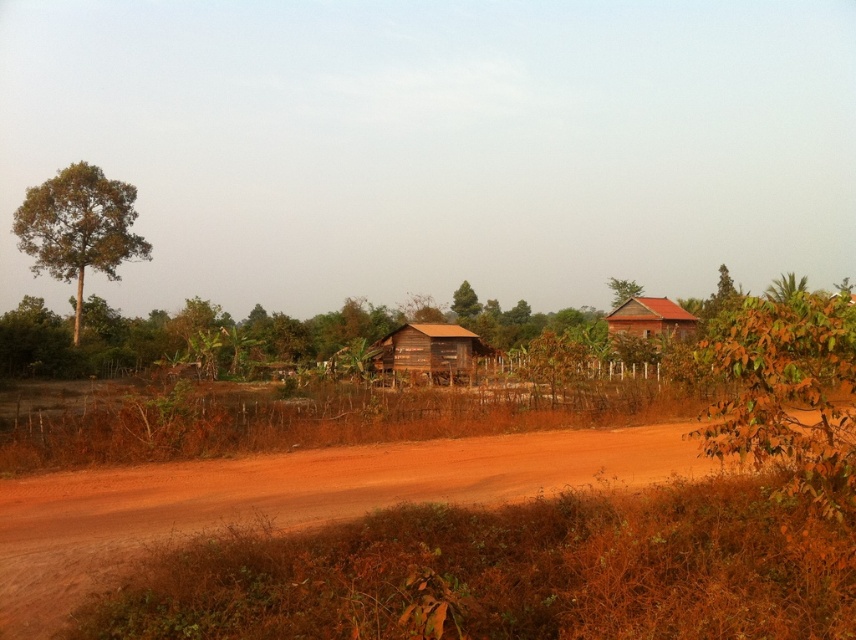
From the picture: Does wooden shack at center appear on the right side of red clay hut at right?

Incorrect, wooden shack at center is not on the right side of red clay hut at right.

Can you confirm if wooden shack at center is positioned to the left of red clay hut at right?

Indeed, wooden shack at center is positioned on the left side of red clay hut at right.

Is point (379, 364) in front of point (652, 308)?

Yes, it is.

You are a GUI agent. You are given a task and a screenshot of the screen. Output one action in this format:
    pyautogui.click(x=<x>, y=<y>)
    Task: Click on the wooden shack at center
    
    Given the screenshot: What is the action you would take?
    pyautogui.click(x=429, y=349)

Is point (675, 444) behind point (438, 332)?

No, it is in front of (438, 332).

Can you confirm if brown dirt field at center is positioned to the right of wooden shack at center?

Yes, brown dirt field at center is to the right of wooden shack at center.

Which is behind, point (177, 500) or point (393, 346)?

Point (393, 346)

The height and width of the screenshot is (640, 856). Find the location of `brown dirt field at center`. brown dirt field at center is located at coordinates (289, 497).

Is red clay hut at right to the left of green matte tree at center from the viewer's perspective?

In fact, red clay hut at right is to the right of green matte tree at center.

Between red clay hut at right and green matte tree at center, which one has less height?

green matte tree at center is shorter.

Who is more distant from viewer, (613, 310) or (474, 314)?

The point (474, 314) is behind.

In order to click on red clay hut at right in this screenshot , I will do `click(646, 323)`.